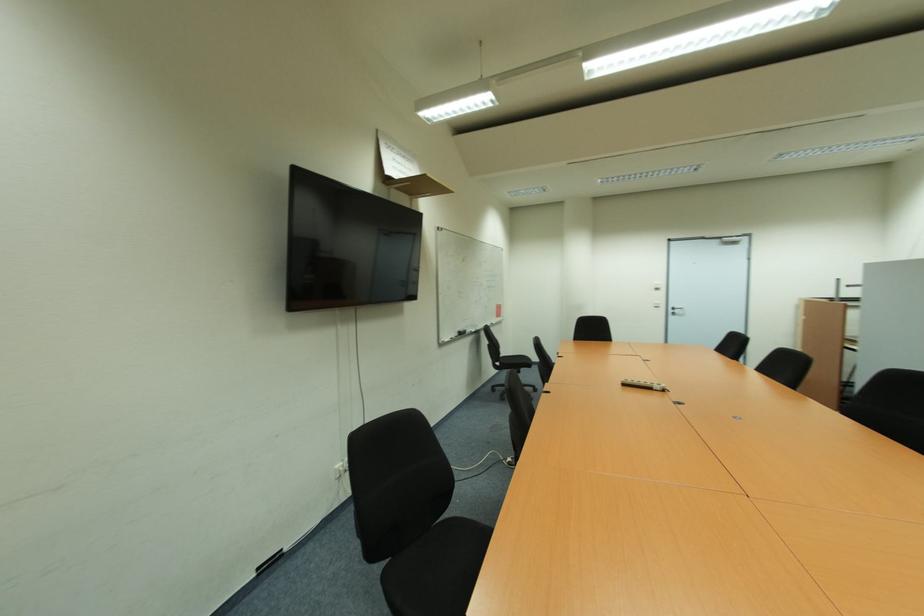
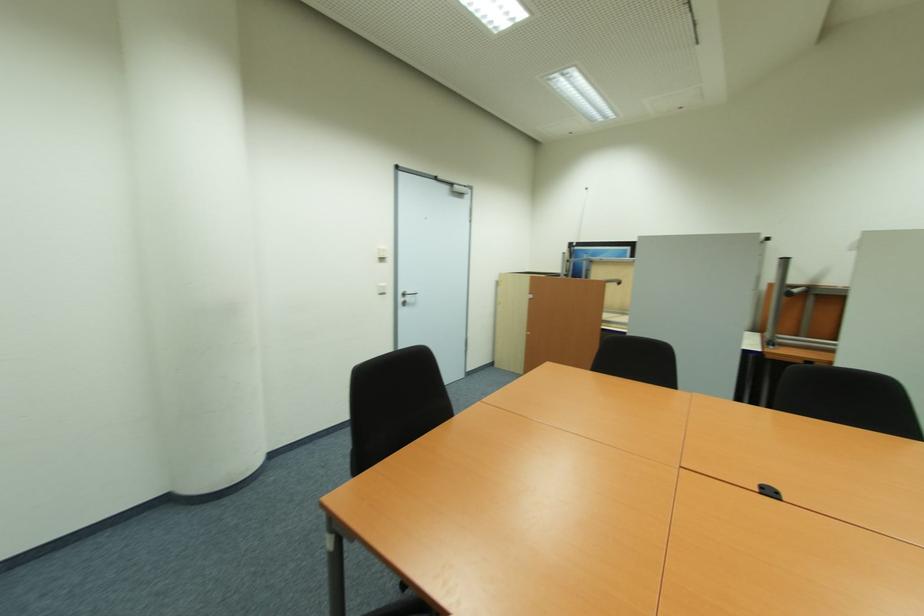
Where in the second image is the point corresponding to pixel 674 312 from the first image?

(405, 300)